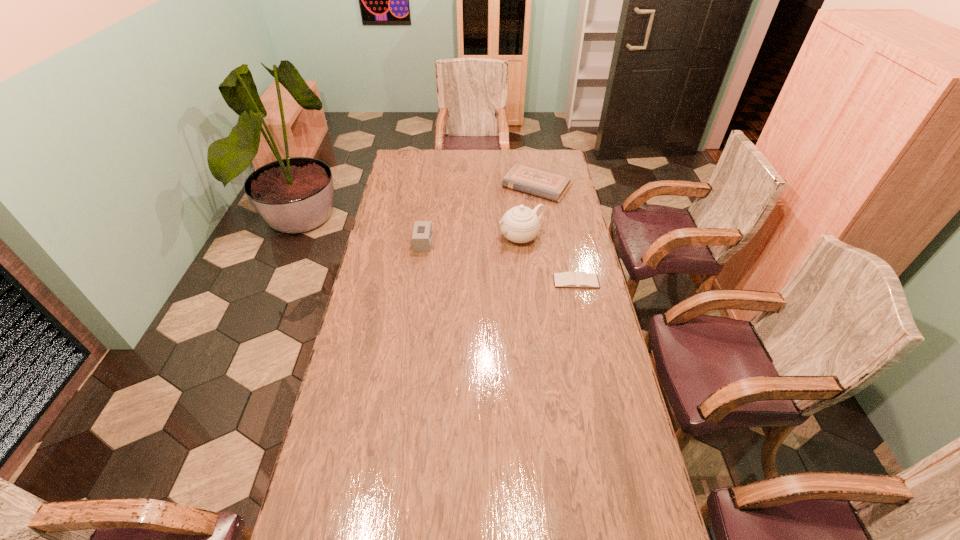
Identify the location of object at the far right corner. (537, 181).

Image resolution: width=960 pixels, height=540 pixels. I want to click on free space at the far edge of the desktop, so click(x=461, y=156).

This screenshot has height=540, width=960. In order to click on free space at the near edge of the desktop in this screenshot , I will do `click(525, 497)`.

Where is `vacant space at the left edge of the desktop`? The width and height of the screenshot is (960, 540). vacant space at the left edge of the desktop is located at coordinates [379, 263].

The image size is (960, 540). I want to click on vacant space at the right edge of the desktop, so click(585, 270).

You are a GUI agent. You are given a task and a screenshot of the screen. Output one action in this format:
    pyautogui.click(x=<x>, y=<y>)
    Task: Click on the vacant space at the far left corner of the desktop
    The height and width of the screenshot is (540, 960).
    Given the screenshot: What is the action you would take?
    pyautogui.click(x=426, y=157)

The height and width of the screenshot is (540, 960). In the image, there is a desktop. Identify the location of free space at the far right corner. (541, 164).

The height and width of the screenshot is (540, 960). In order to click on vacant area between the farthest object and the shortest object in this screenshot , I will do `click(556, 234)`.

Locate an element on the screen. vacant point located between the chinaware and the alarm clock is located at coordinates (472, 240).

You are a GUI agent. You are given a task and a screenshot of the screen. Output one action in this format:
    pyautogui.click(x=<x>, y=<y>)
    Task: Click on the blank region between the alarm clock and the farthest object
    
    Given the screenshot: What is the action you would take?
    pyautogui.click(x=480, y=214)